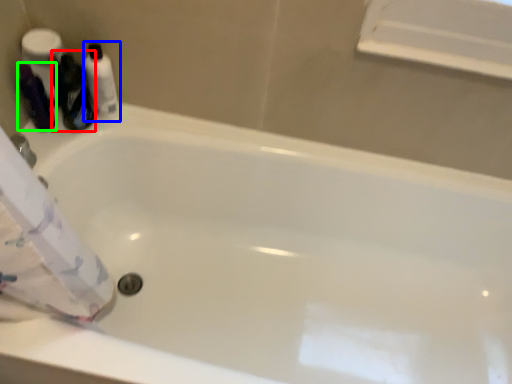
Question: Which object is the closest to the cleaning product (highlighted by a red box)? Choose among these: toiletry (highlighted by a blue box) or toiletry (highlighted by a green box).

Choices:
 (A) toiletry
 (B) toiletry

Answer: (A)